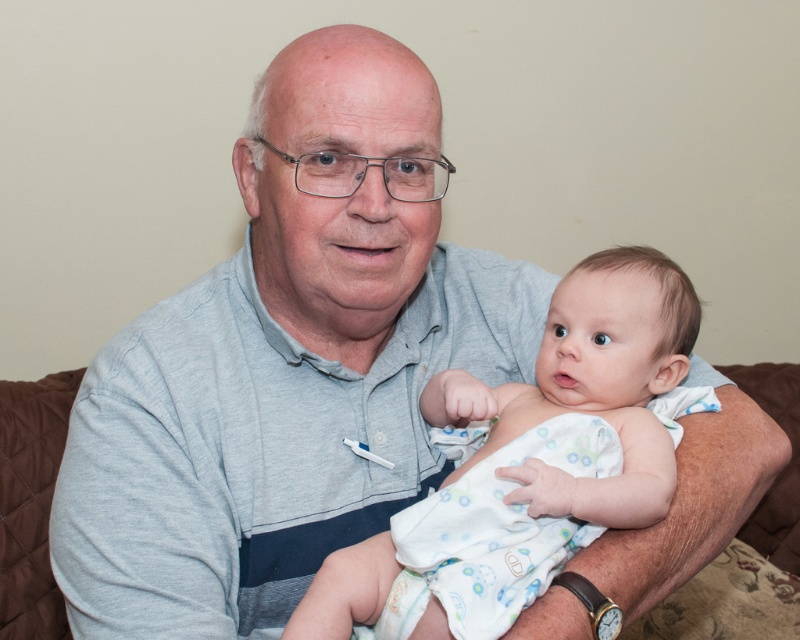
You are a photographer setting up for a family portrait. You need to ensure that the white cotton baby at center is visible in the frame without being blocked by the brown quilted couch at center. Based on the scene description, can you confirm if the baby will be visible?

The white cotton baby at center is above the brown quilted couch at center, so it will be visible in the frame without being blocked by the couch.

You are a photographer taking a picture of the scene. You notice the point at coordinate (532, 458). What is located at that point?

The point at coordinate (532, 458) indicates the white cotton baby at center.